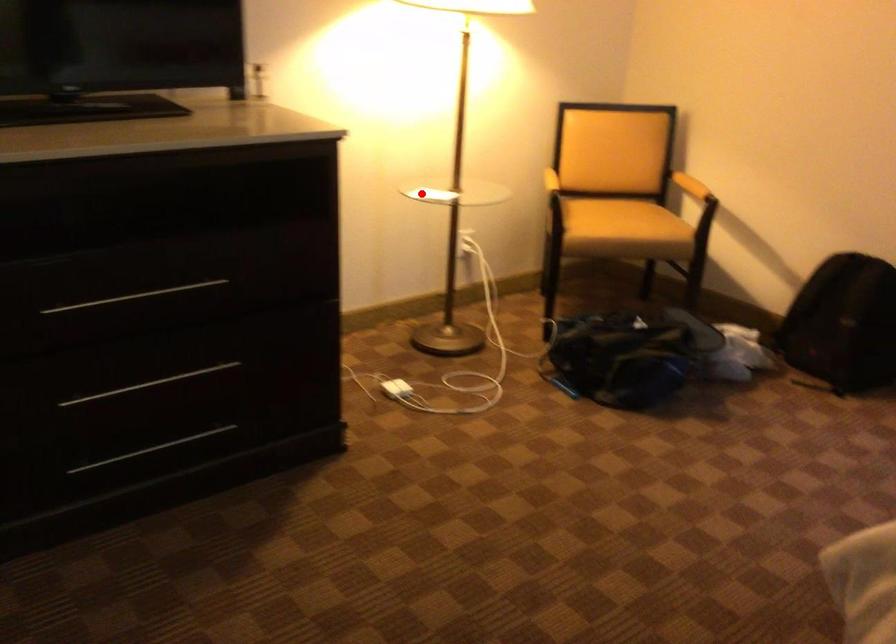
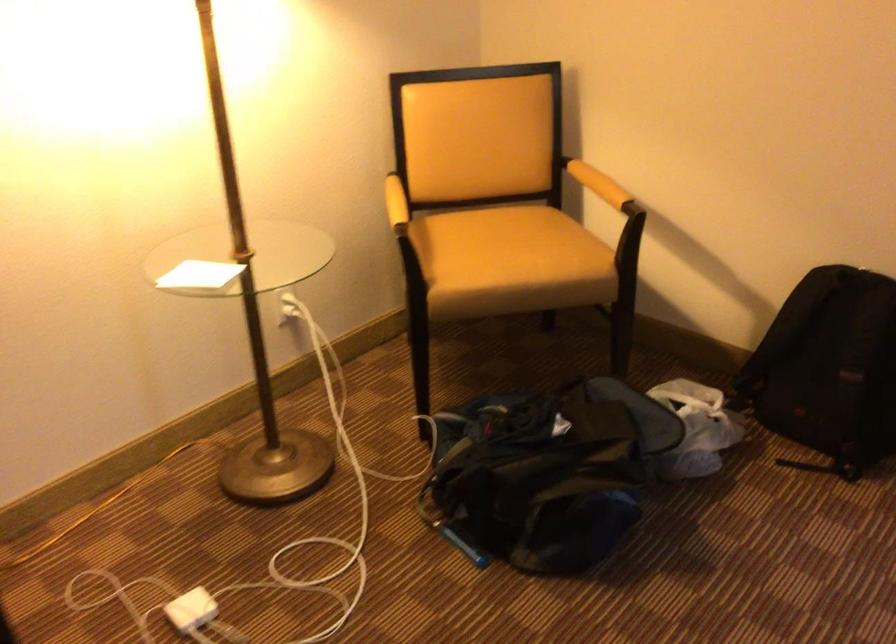
Where in the second image is the point corresponding to the highlighted location from the first image?

(199, 275)